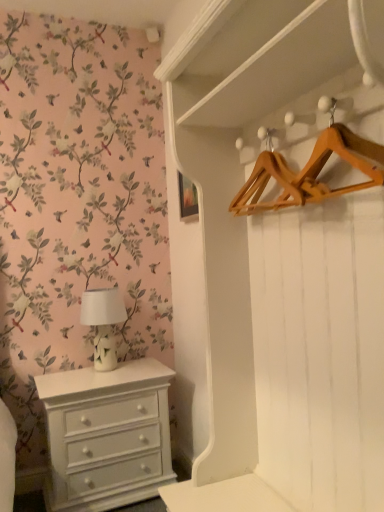
Question: In terms of width, does white glossy table lamp at left look wider or thinner when compared to white painted wood chest of drawers at lower left?

Choices:
 (A) wide
 (B) thin

Answer: (B)

Question: Considering the relative positions of white glossy table lamp at left and white painted wood chest of drawers at lower left in the image provided, is white glossy table lamp at left to the left or to the right of white painted wood chest of drawers at lower left?

Choices:
 (A) left
 (B) right

Answer: (A)

Question: Considering the real-world distances, which object is farthest from the wooden hanger at upper right?

Choices:
 (A) white glossy table lamp at left
 (B) white painted wood chest of drawers at lower left

Answer: (B)

Question: Based on their relative distances, which object is farther from the white glossy table lamp at left?

Choices:
 (A) white painted wood chest of drawers at lower left
 (B) wooden hanger at upper right

Answer: (B)